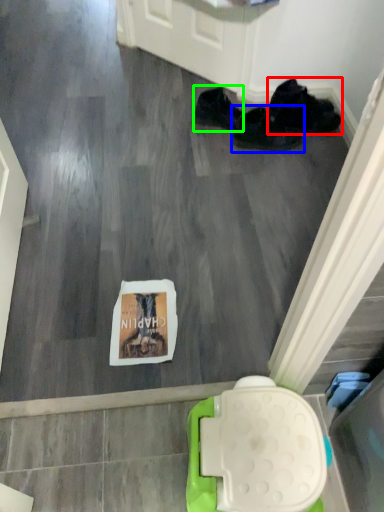
Question: Which object is positioned closest to footwear (highlighted by a red box)? Select from footwear (highlighted by a blue box) and footwear (highlighted by a green box).

Choices:
 (A) footwear
 (B) footwear

Answer: (A)